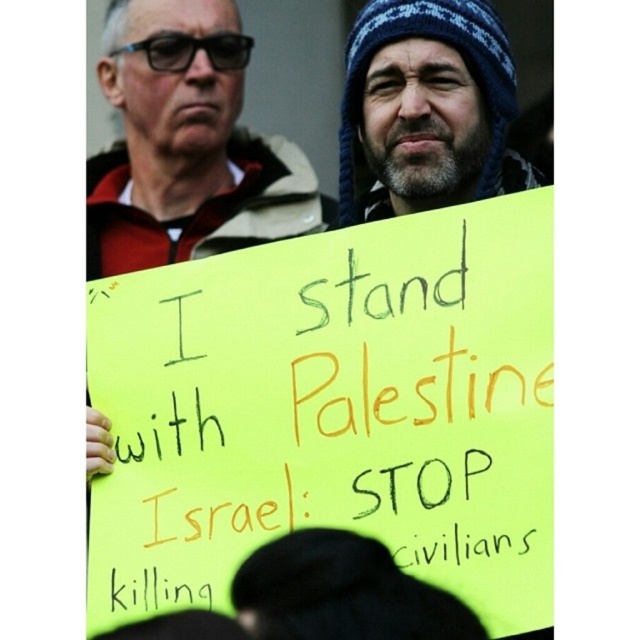
Question: Does matte black jacket at upper left appear over blue knitted hat at upper right?

Choices:
 (A) yes
 (B) no

Answer: (A)

Question: Which point appears farthest from the camera in this image?

Choices:
 (A) (451, 144)
 (B) (104, 93)

Answer: (B)

Question: Among these objects, which one is nearest to the camera?

Choices:
 (A) matte black jacket at upper left
 (B) blue knitted hat at upper right

Answer: (B)

Question: Among these objects, which one is farthest from the camera?

Choices:
 (A) blue knitted hat at upper right
 (B) matte black jacket at upper left

Answer: (B)

Question: Does matte black jacket at upper left lie behind blue knitted hat at upper right?

Choices:
 (A) yes
 (B) no

Answer: (A)

Question: Does matte black jacket at upper left lie behind blue knitted hat at upper right?

Choices:
 (A) yes
 (B) no

Answer: (A)